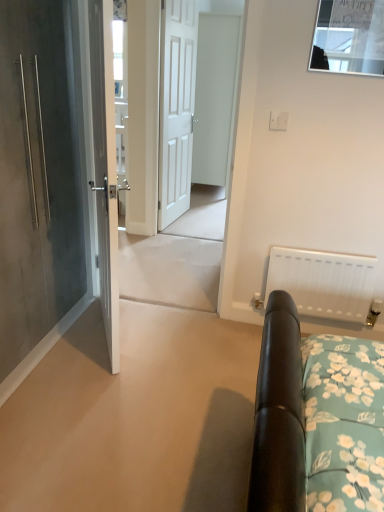
Question: From a real-world perspective, relative to white matte door at center, marked as the second door in a right-to-left arrangement, is white matte door at center, marked as the fourth door in a left-to-right arrangement, vertically above or below?

Choices:
 (A) below
 (B) above

Answer: (B)

Question: Looking at the image, does white matte door at center, which is the first door from right to left, seem bigger or smaller compared to white matte door at center, the 3th door when ordered from left to right?

Choices:
 (A) big
 (B) small

Answer: (A)

Question: Which object is positioned closest to the matte gray door at left, acting as the 1th door starting from the left?

Choices:
 (A) white matte door at center, marked as the second door in a right-to-left arrangement
 (B) white matte door at center, marked as the fourth door in a left-to-right arrangement
 (C) white wooden door at center
 (D) clear glass window at upper center
 (E) white matte radiator at right

Answer: (D)

Question: Based on their relative distances, which object is nearer to the white matte door at center, marked as the second door in a right-to-left arrangement?

Choices:
 (A) white matte door at center, marked as the fourth door in a left-to-right arrangement
 (B) clear glass window at upper center
 (C) white glossy door at center, positioned as the second door in left-to-right order
 (D) white matte radiator at right
 (E) matte gray door at left, acting as the 1th door starting from the left

Answer: (A)